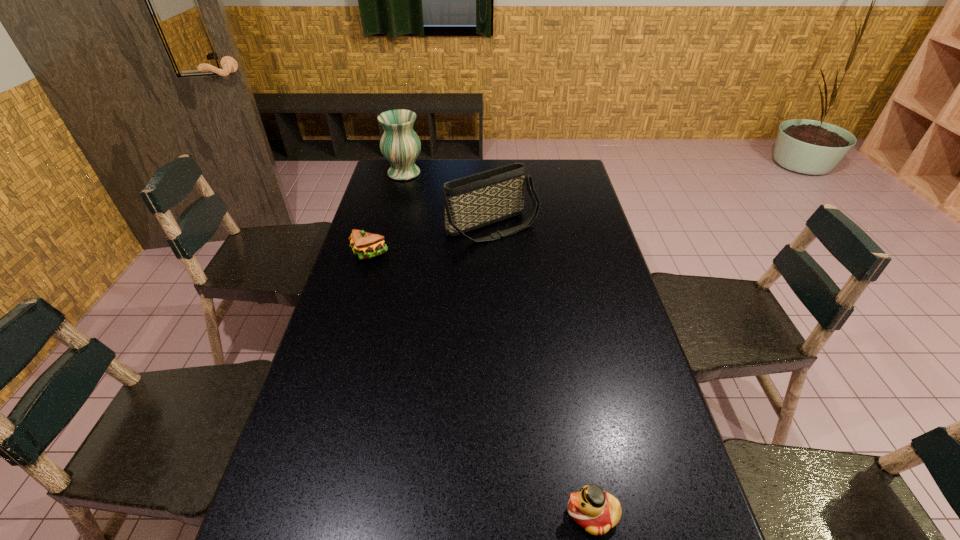
What are the coordinates of `vacant area in the image that satisfies the following two spatial constraints: 1. on the front side of the vase; 2. on the right side of the third shortest object` in the screenshot? It's located at (390, 226).

Locate an element on the screen. Image resolution: width=960 pixels, height=540 pixels. free space in the image that satisfies the following two spatial constraints: 1. on the back side of the vase; 2. on the left side of the sandwich is located at coordinates (393, 173).